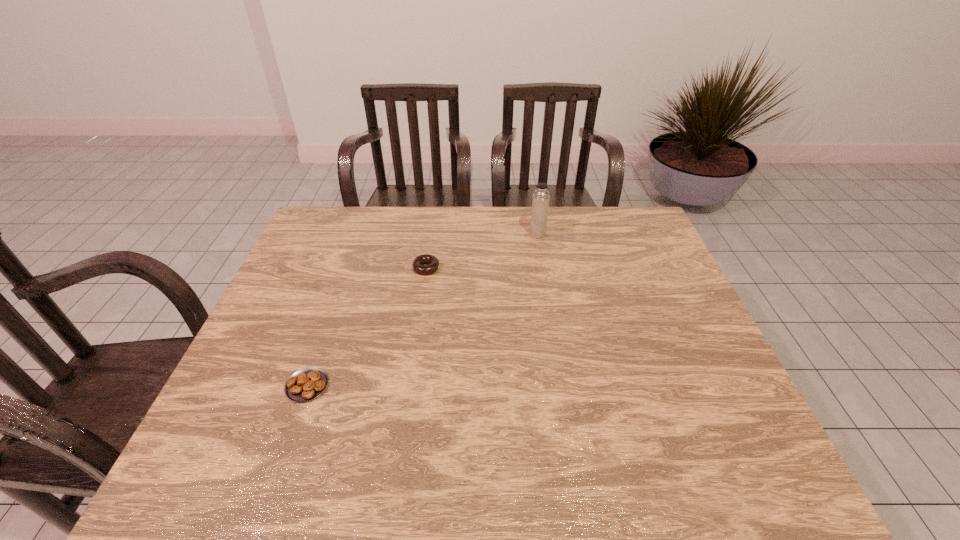
Where is `vacant point that satisfies the following two spatial constraints: 1. on the back side of the leftmost object; 2. on the right side of the tallest object`? vacant point that satisfies the following two spatial constraints: 1. on the back side of the leftmost object; 2. on the right side of the tallest object is located at coordinates (360, 234).